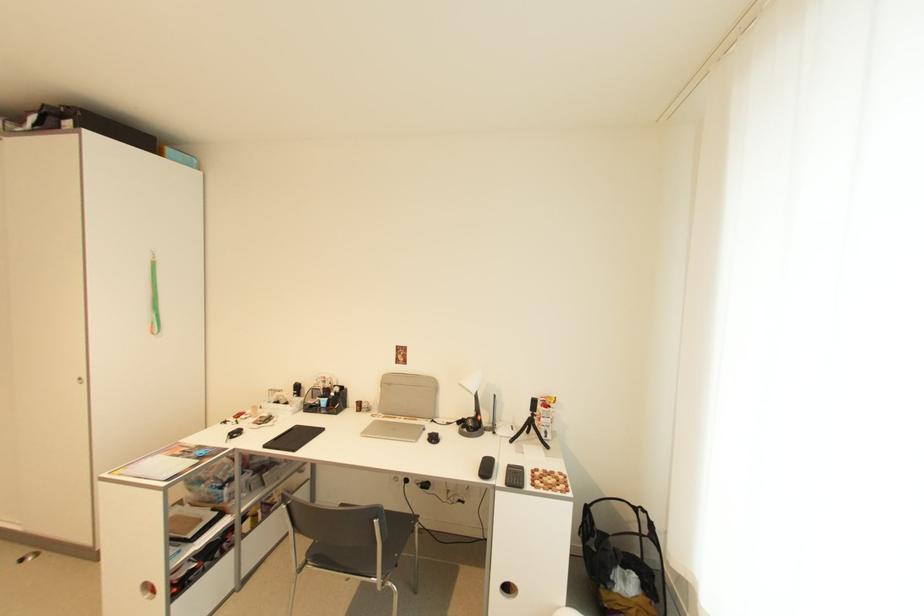
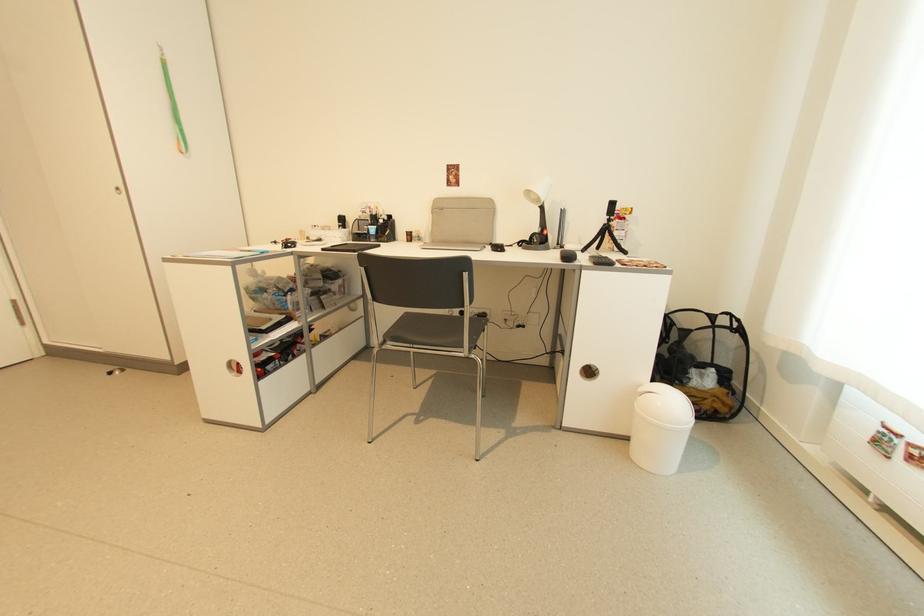
Find the pixel in the second image that matches [157,329] in the first image.

(185, 146)